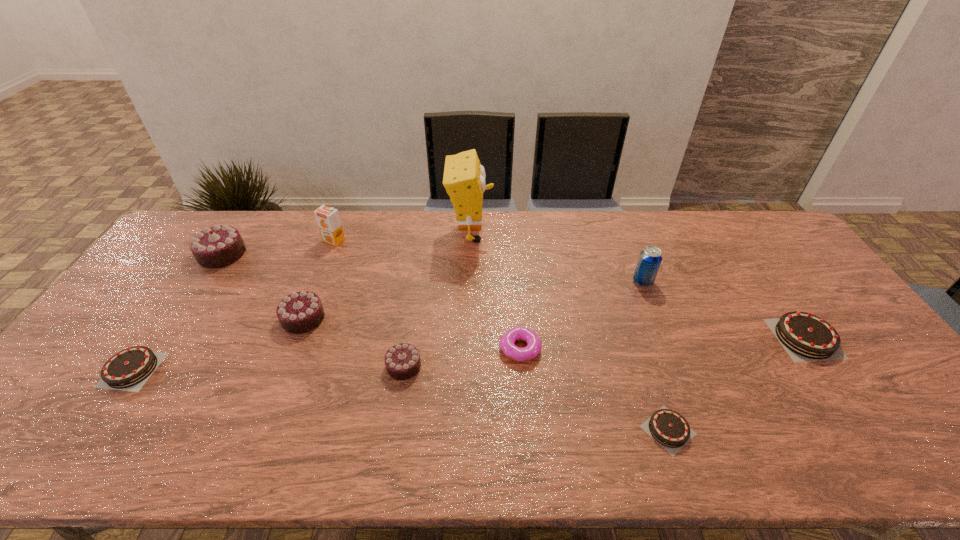
You are a GUI agent. You are given a task and a screenshot of the screen. Output one action in this format:
    pyautogui.click(x=<x>, y=<y>)
    Task: Click on the object that is the nearest to the fifth shortest chocolate cake
    Image resolution: width=960 pixels, height=540 pixels.
    Given the screenshot: What is the action you would take?
    pyautogui.click(x=402, y=361)

Locate which chocolate cake is the fifth closest to the seventh object from left to right. Please provide its 2D coordinates. Your answer should be formatted as a tuple, i.e. [(x, y)], where the tuple contains the x and y coordinates of a point satisfying the conditions above.

[(218, 246)]

In order to click on chocolate cake that is the closest to the leftmost chocolate chocolate cake in this screenshot , I will do `click(300, 312)`.

Identify the location of chocolate chocolate cake that is the closest one to the sixth shortest object. This screenshot has height=540, width=960. (402, 361).

Locate an element on the screen. The width and height of the screenshot is (960, 540). the second closest chocolate chocolate cake relative to the orange juice is located at coordinates (300, 312).

At what (x,y) coordinates should I click in order to perform the action: click on brown chocolate cake object that ranks as the closest to the fourth object from right to left. Please return your answer as a coordinate pair (x, y). Image resolution: width=960 pixels, height=540 pixels. Looking at the image, I should click on (668, 428).

The image size is (960, 540). I want to click on brown chocolate cake that stands as the closest to the tallest chocolate cake, so click(128, 370).

Locate an element on the screen. vacant space that satisfies the following two spatial constraints: 1. on the face of the biggest brown chocolate cake; 2. on the right side of the yellow sponge is located at coordinates (468, 338).

The height and width of the screenshot is (540, 960). I want to click on free region that satisfies the following two spatial constraints: 1. on the back side of the rightmost object; 2. on the right side of the second brown chocolate cake from left to right, so click(x=637, y=338).

This screenshot has width=960, height=540. Find the location of `free point that satisfies the following two spatial constraints: 1. on the front side of the farthest chocolate chocolate cake; 2. on the right side of the second brown chocolate cake from left to right`. free point that satisfies the following two spatial constraints: 1. on the front side of the farthest chocolate chocolate cake; 2. on the right side of the second brown chocolate cake from left to right is located at coordinates (106, 430).